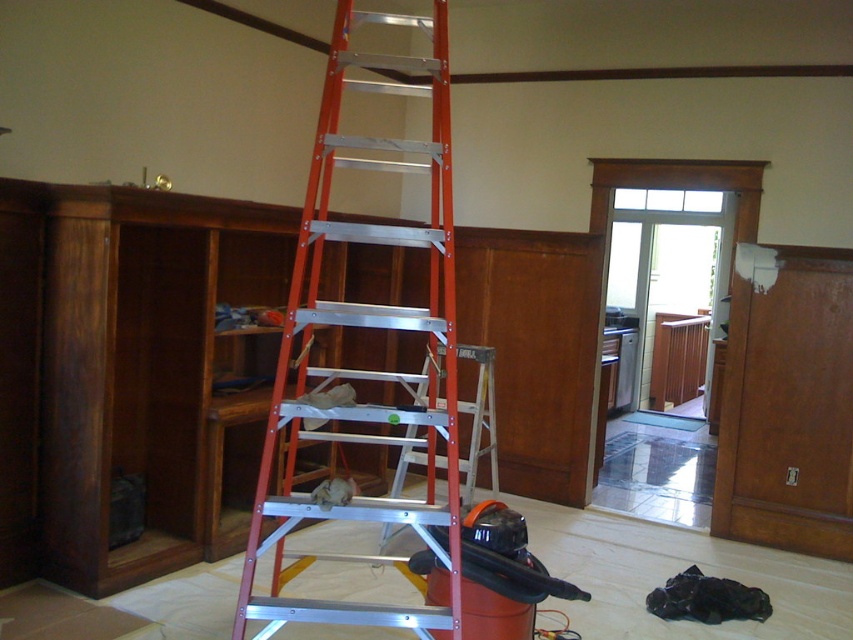
You are a construction worker who needs to climb a ladder to reach the ceiling. You see an orange metallic ladder at center and a red aluminum ladder at center. Which ladder should you choose to reach the ceiling without needing to move the other ladder?

The orange metallic ladder at center is positioned over the red aluminum ladder at center, so you should choose the orange metallic ladder at center to reach the ceiling without moving the other ladder.

You are a construction worker who needs to climb a ladder to reach the ceiling. You see an orange metallic ladder at center and a red aluminum ladder at center. Which ladder should you choose if you want to use the one closer to you?

You should choose the orange metallic ladder at center because it is in front of the red aluminum ladder at center, making it closer to you.

You are a painter needing to choose between the orange metallic ladder at center and the red aluminum ladder at center for a job that requires a wider ladder. Which ladder should you choose?

The orange metallic ladder at center is wider than the red aluminum ladder at center, so you should choose the orange metallic ladder at center for the job.